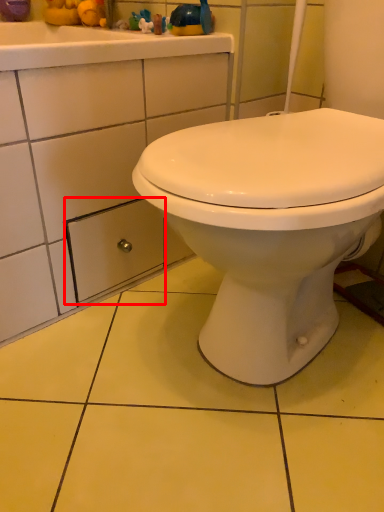
Question: From the image's perspective, considering the relative positions of drawer (annotated by the red box) and toy in the image provided, where is drawer (annotated by the red box) located with respect to the staircase?

Choices:
 (A) above
 (B) below

Answer: (B)